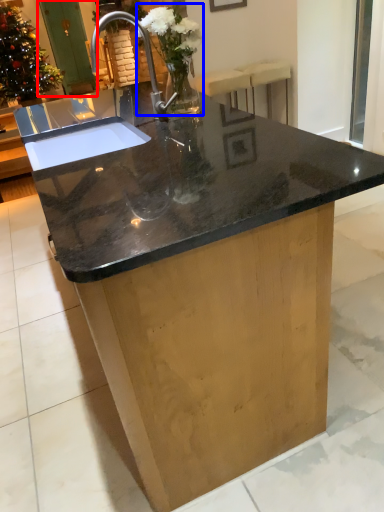
Question: Which object appears farthest to the camera in this image, screen door (highlighted by a red box) or floral arrangement (highlighted by a blue box)?

Choices:
 (A) screen door
 (B) floral arrangement

Answer: (A)